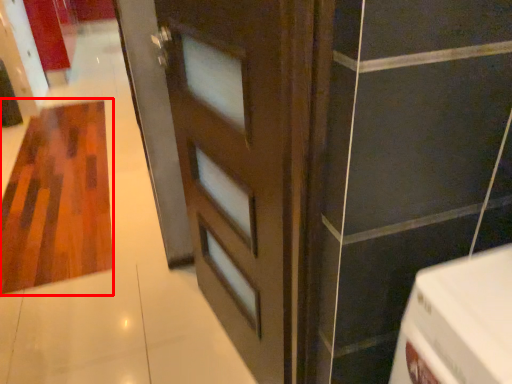
Question: Where is hardwood (annotated by the red box) located in relation to door in the image?

Choices:
 (A) right
 (B) left

Answer: (B)